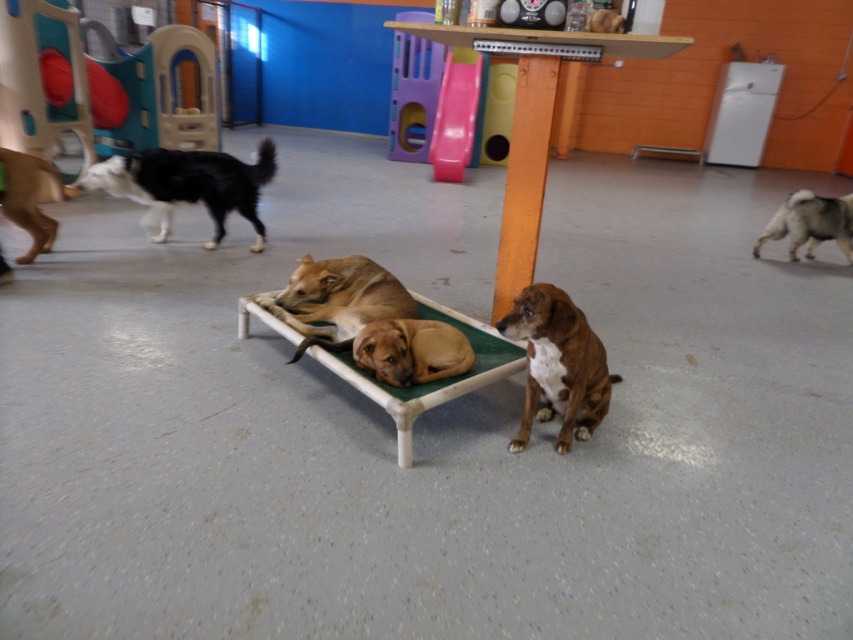
Does black and white fur at upper left appear under brown fur dog at left?

Incorrect, black and white fur at upper left is not positioned below brown fur dog at left.

Can you confirm if black and white fur at upper left is smaller than brown fur dog at left?

Incorrect, black and white fur at upper left is not smaller in size than brown fur dog at left.

Image resolution: width=853 pixels, height=640 pixels. I want to click on black and white fur at upper left, so click(x=187, y=186).

Locate an element on the screen. This screenshot has height=640, width=853. black and white fur at upper left is located at coordinates (187, 186).

Who is more distant from viewer, (364, 358) or (778, 221)?

Positioned behind is point (778, 221).

This screenshot has height=640, width=853. In order to click on brown matte dog at center in this screenshot , I will do `click(410, 349)`.

Locate an element on the screen. brown matte dog at center is located at coordinates (410, 349).

Between black and white fur at upper left and brown matte dog at center, which one is positioned higher?

black and white fur at upper left is higher up.

Is black and white fur at upper left wider than brown matte dog at center?

Correct, the width of black and white fur at upper left exceeds that of brown matte dog at center.

Between point (112, 157) and point (376, 360), which one is positioned behind?

The point (112, 157) is more distant.

I want to click on black and white fur at upper left, so click(x=187, y=186).